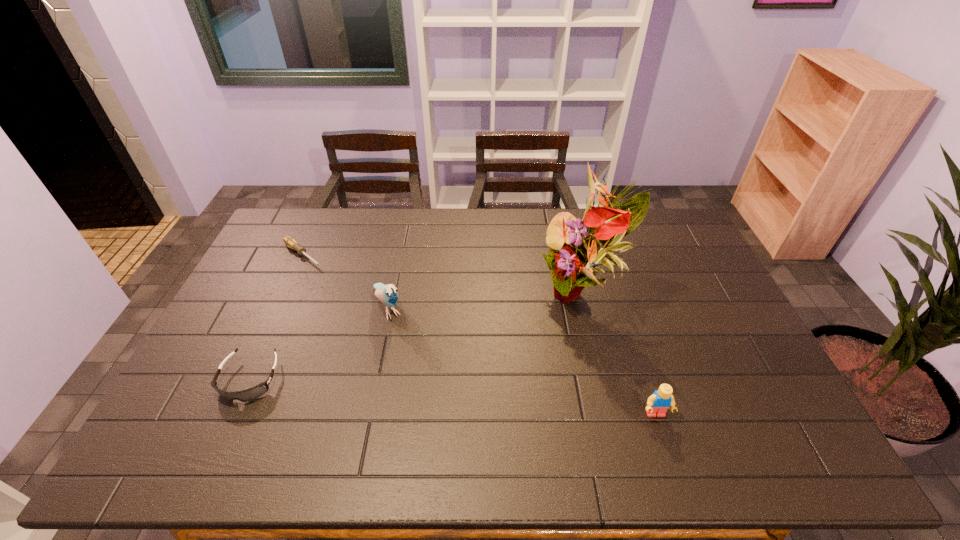
Find the location of `object that can be found as the fourth closest to the bird`. object that can be found as the fourth closest to the bird is located at coordinates [658, 403].